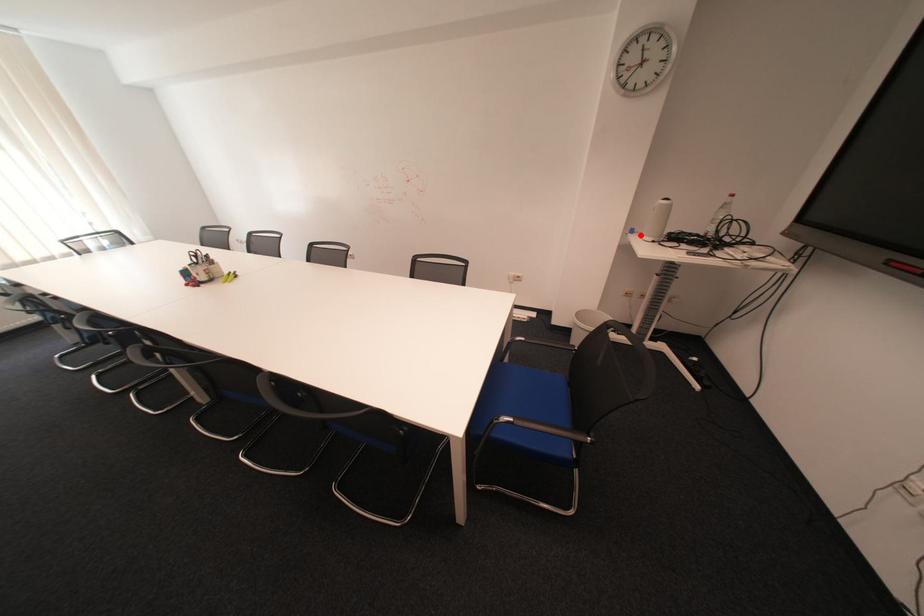
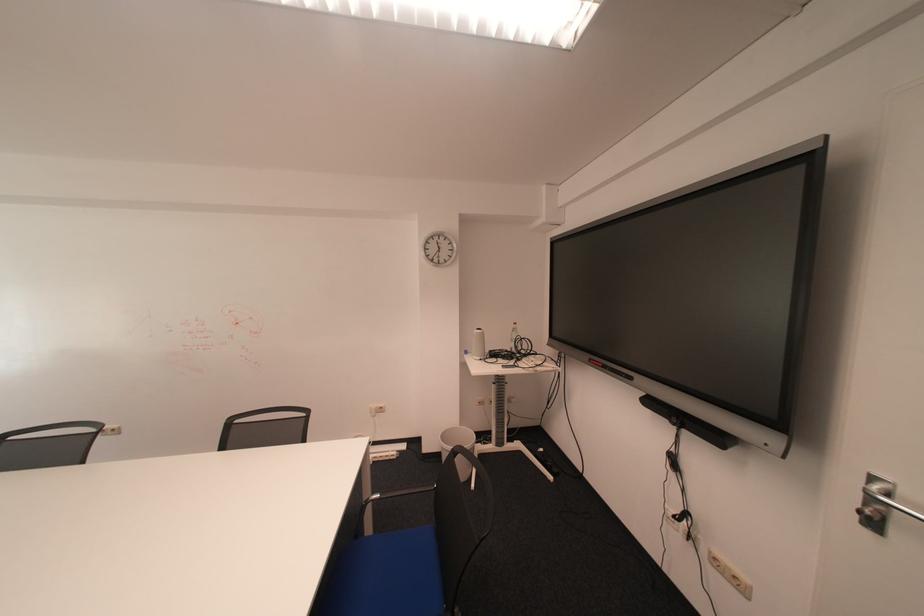
Question: I am providing you with two images of the same scene from different viewpoints. Image1 has a red point marked. In image2, the corresponding 3D location appears at what relative position? Reply with the corresponding letter.

Choices:
 (A) Closer
 (B) Farther

Answer: (B)